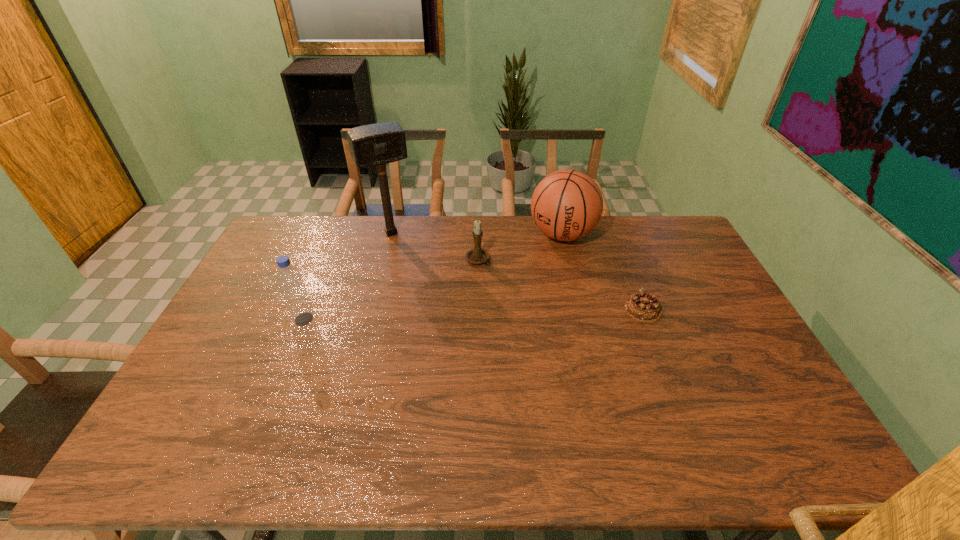
The image size is (960, 540). What are the coordinates of `free spot on the desktop that is between the leftmost object and the rightmost object and is positioned on the head of the mallet` in the screenshot? It's located at (434, 315).

In order to click on free spot on the desktop that is between the bottle and the shortest object and is positioned on the side of the fourth tallest object with the handle in this screenshot , I will do `click(501, 314)`.

I want to click on vacant spot on the desktop that is between the leftmost object and the chocolate cake and is positioned on the surface of the basketball near the brand logo, so click(x=518, y=313).